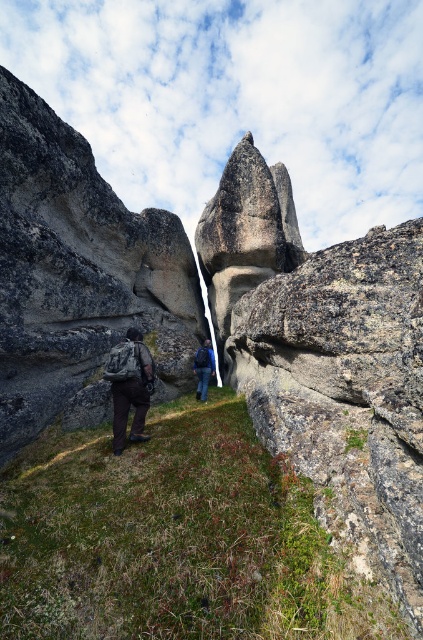
Question: Estimate the real-world distances between objects in this image. Which object is closer to the blue fabric backpack at center?

Choices:
 (A) rough gray rock formation at center
 (B) dark gray backpack at center

Answer: (A)

Question: Is rough gray rock formation at center bigger than blue fabric backpack at center?

Choices:
 (A) yes
 (B) no

Answer: (A)

Question: Estimate the real-world distances between objects in this image. Which object is closer to the dark gray backpack at center?

Choices:
 (A) rough gray rock formation at center
 (B) blue fabric backpack at center

Answer: (B)

Question: Where is rough gray rock formation at center located in relation to blue fabric backpack at center in the image?

Choices:
 (A) left
 (B) right

Answer: (A)

Question: Which is farther from the rough gray rock formation at center?

Choices:
 (A) dark gray backpack at center
 (B) blue fabric backpack at center

Answer: (A)

Question: Does dark gray backpack at center lie behind blue fabric backpack at center?

Choices:
 (A) no
 (B) yes

Answer: (A)